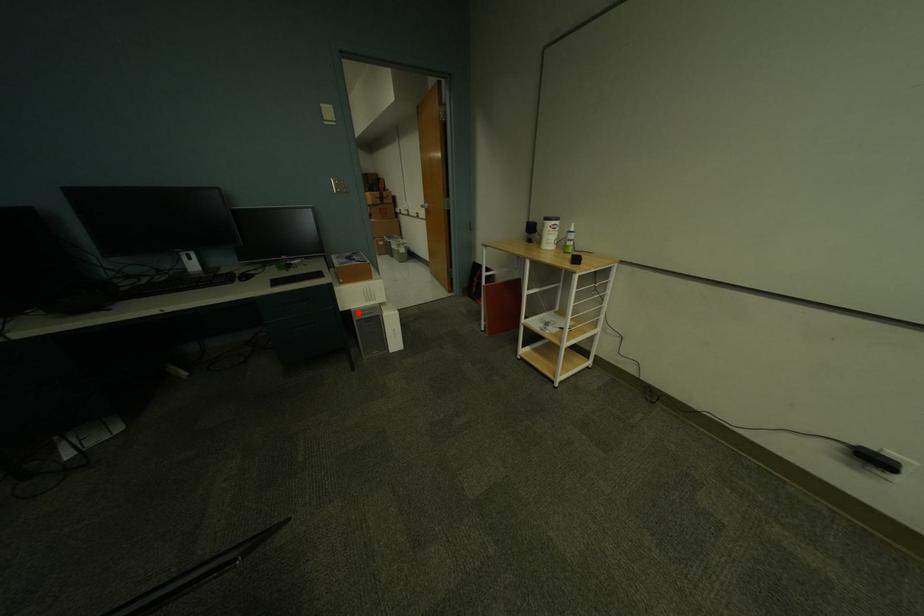
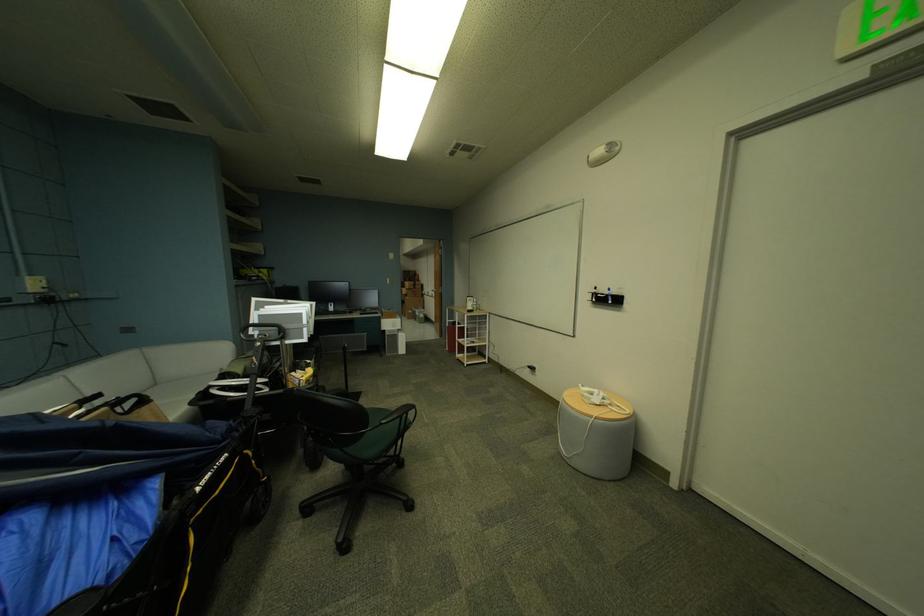
Question: I am providing you with two images of the same scene from different viewpoints. In image1, a red point is highlighted. Considering the same 3D point in image2, which of the following is correct?

Choices:
 (A) It is closer
 (B) It is farther

Answer: (A)